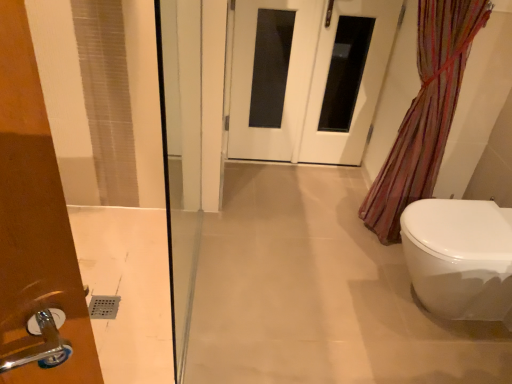
This screenshot has width=512, height=384. Identify the location of vacant region in front of white glossy door at center. (260, 187).